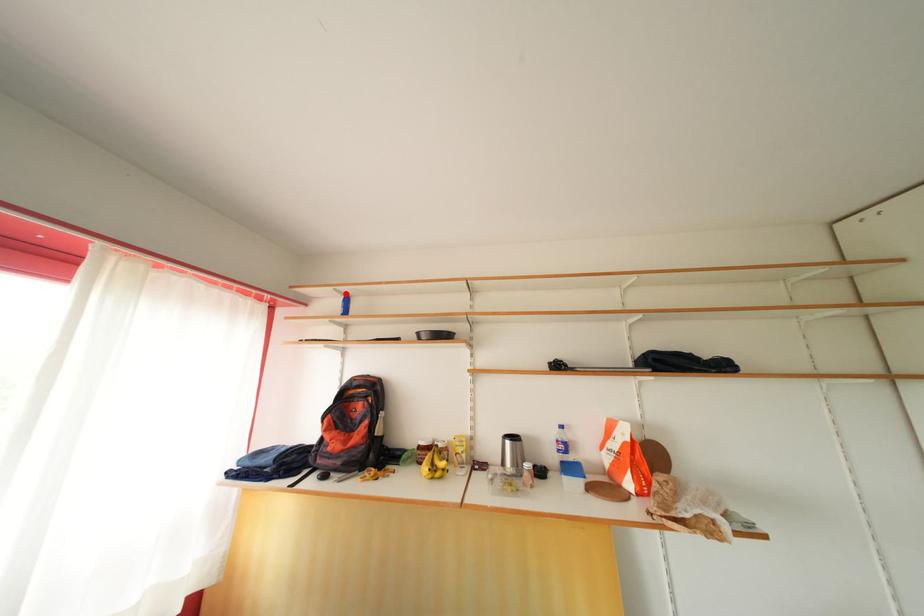
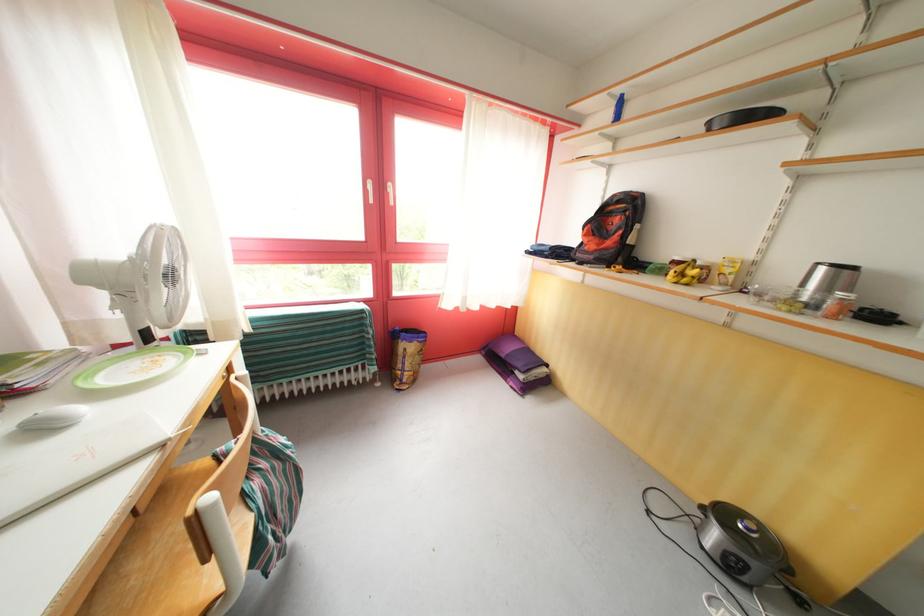
Where in the second image is the point corresponding to the highlighted location from the first image?

(621, 95)